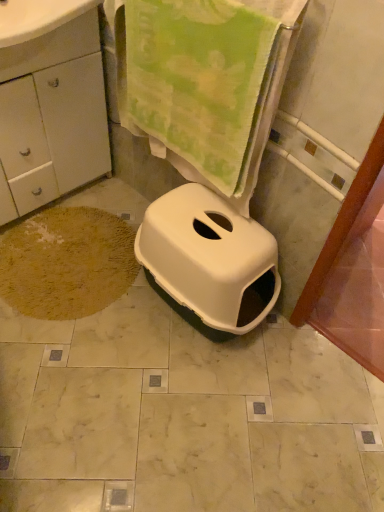
Find the location of a particular element. empty space that is ontop of brown shaggy rug at lower left (from a real-world perspective) is located at coordinates (59, 255).